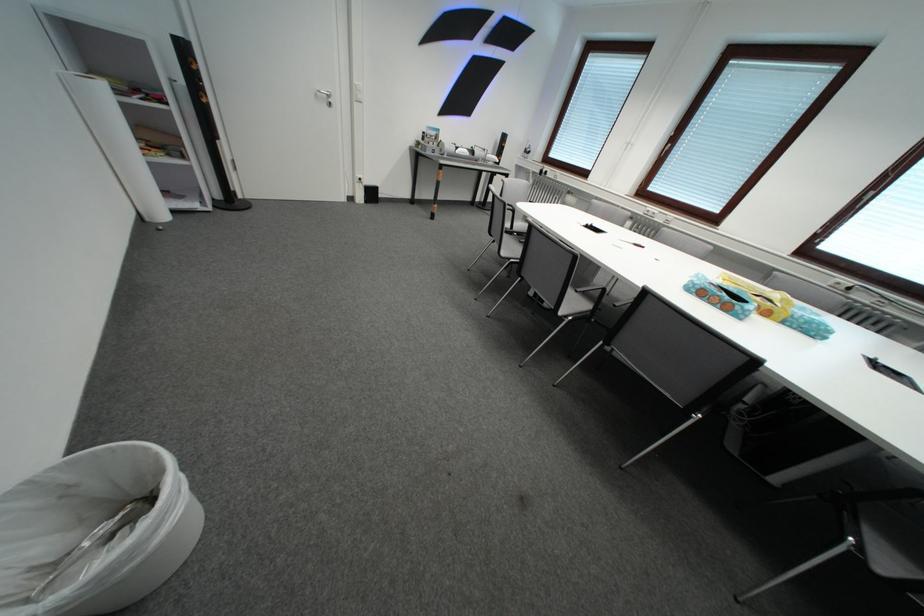
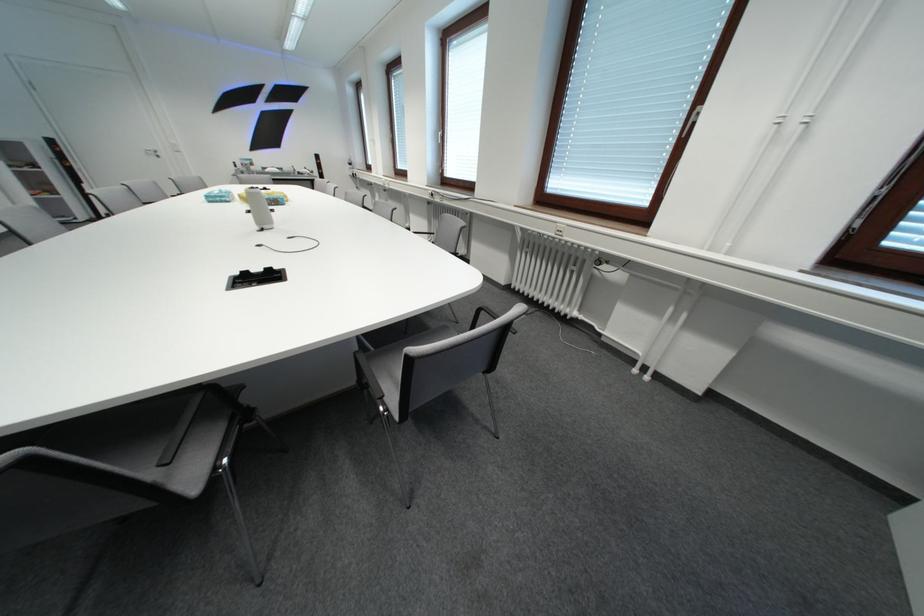
Question: I am providing you with two images of the same scene from different viewpoints. After the viewpoint changes to image2, which objects are now occluded?

Choices:
 (A) black whiteboard magnet
 (B) white window handle
 (C) grey chair sitting surface
 (D) tissue box

Answer: (C)